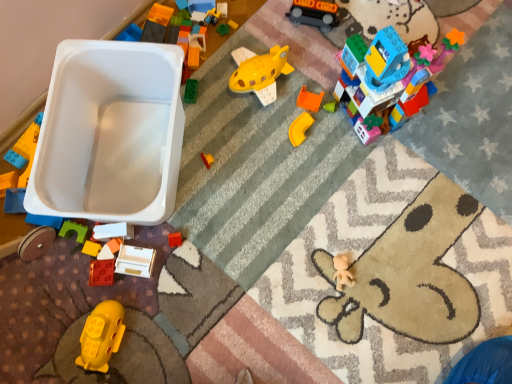
Identify the location of vacant point to the right of yellow matte toy submarine at lower left, which is the first toy from bottom to top. The width and height of the screenshot is (512, 384). (169, 327).